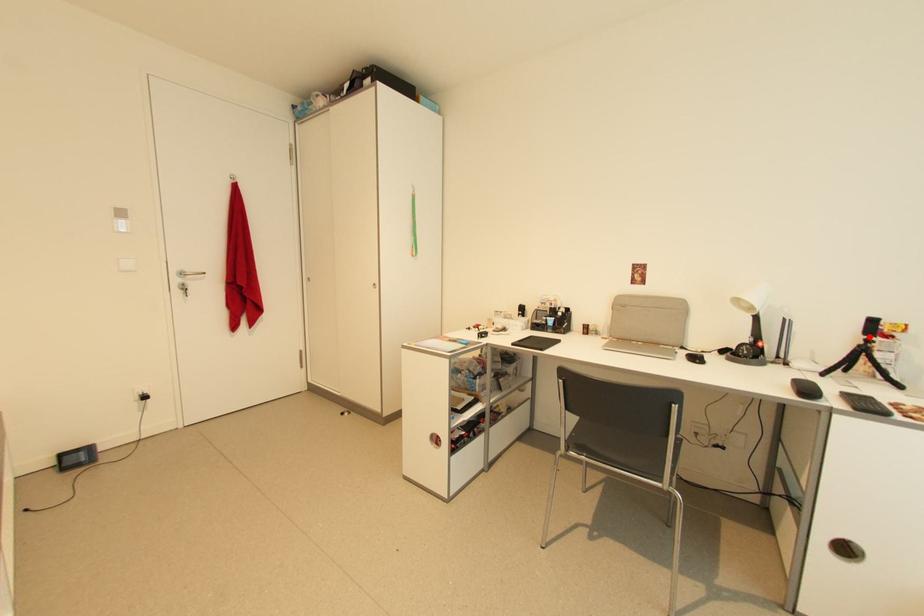
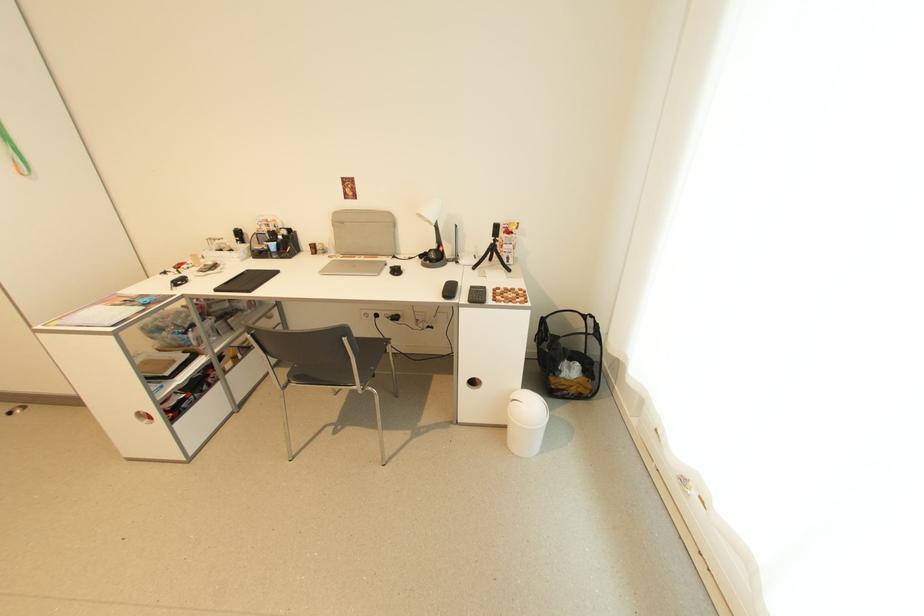
Question: I am providing you with two images of the same scene from different viewpoints. In image1, a red point is highlighted. Considering the same 3D point in image2, which of the following is correct?

Choices:
 (A) It is closer
 (B) It is farther

Answer: (A)